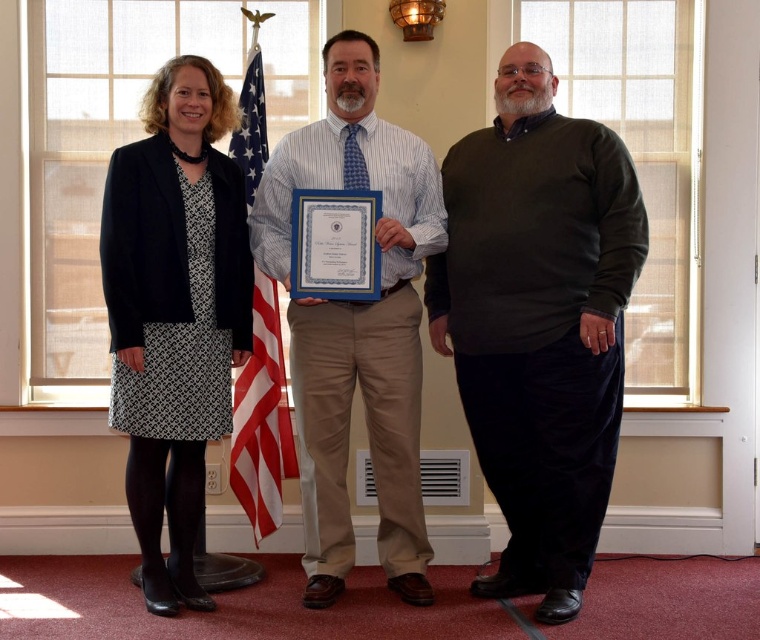
From the picture: You are a photographer positioned behind the dark green sweater at center and the american flag at center. You need to take a photo of both objects in the same frame. Given that your camera has a maximum focus range of 3 feet, will you be able to capture both objects clearly in one shot?

The distance between the dark green sweater at center and the american flag at center is 3.76 feet. Since the camera can only focus within 3 feet, the objects are too far apart to be captured clearly in the same frame.

Based on the scene description, which object is taller between the matte black dress at center and the dark green sweater at center?

The matte black dress at center is taller than the dark green sweater at center according to the description.